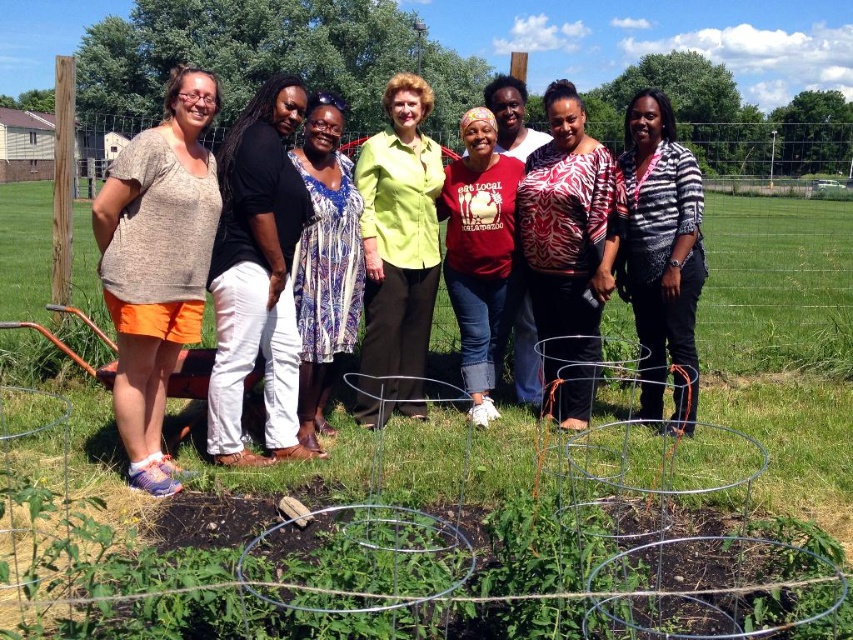
You are a photographer trying to capture a closeup of the blue printed dress at center. Based on the scene description, where should you position your camera to ensure the dress is centered in your shot?

The blue printed dress at center is located at point (x=325, y=262) in the image. To center it in your shot, position your camera so that the dress aligns with the center of your viewfinder, which corresponds to the coordinates (x=325, y=262).